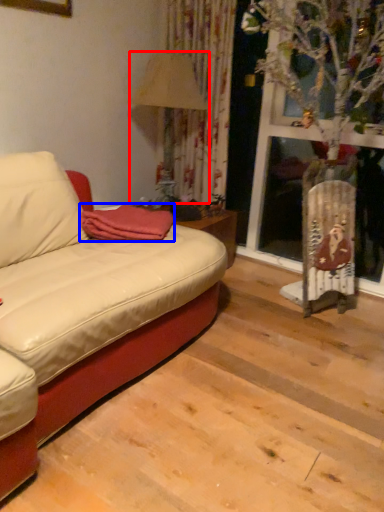
Question: Which of the following is the farthest to the observer, lamp (highlighted by a red box) or blanket (highlighted by a blue box)?

Choices:
 (A) lamp
 (B) blanket

Answer: (A)